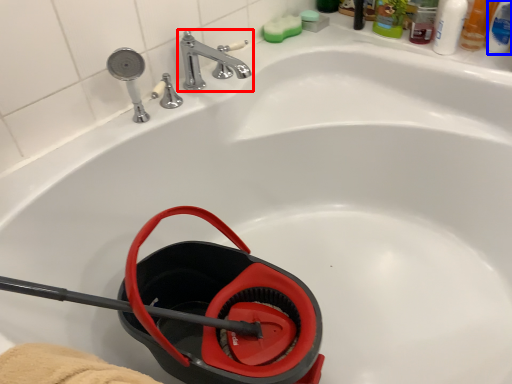
Question: Which object is closer to the camera taking this photo, tap (highlighted by a red box) or mouthwash (highlighted by a blue box)?

Choices:
 (A) tap
 (B) mouthwash

Answer: (A)